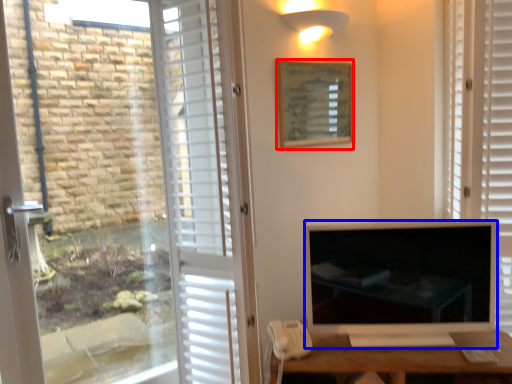
Question: Which of the following is the closest to the observer, picture frame (highlighted by a red box) or television (highlighted by a blue box)?

Choices:
 (A) picture frame
 (B) television

Answer: (B)